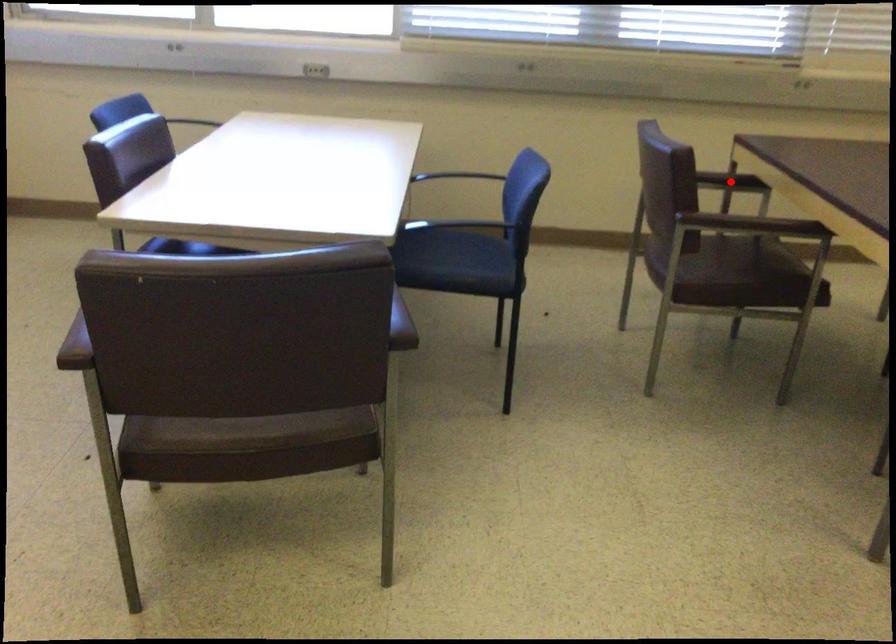
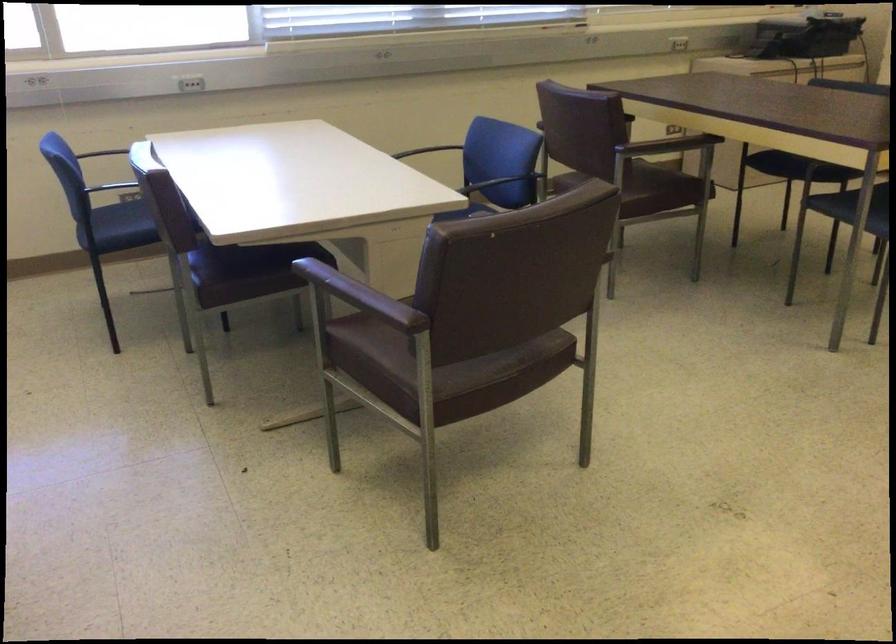
Question: I am providing you with two images of the same scene from different viewpoints. A red point is marked on the first image. Is the red point's position out of view in image 2?

Choices:
 (A) Yes
 (B) No

Answer: (A)